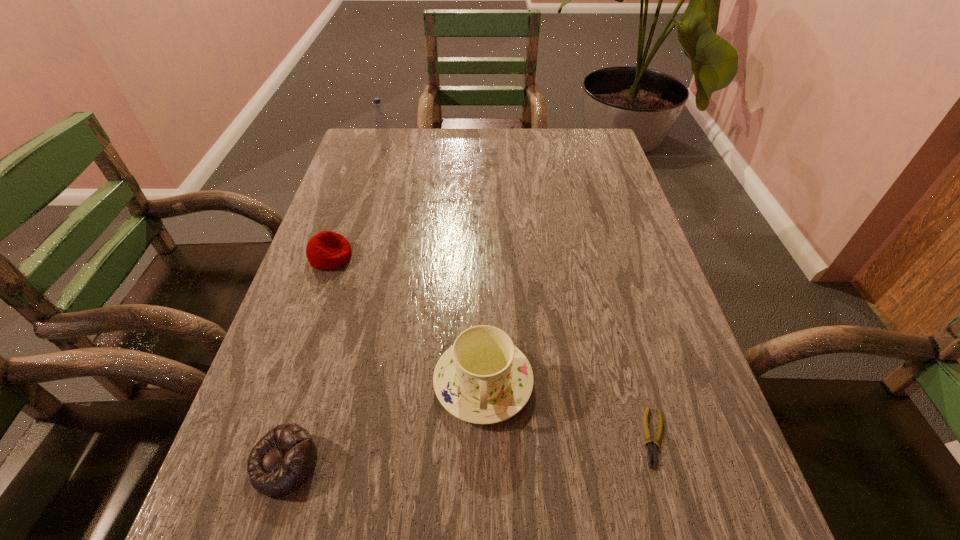
This screenshot has width=960, height=540. In order to click on vacant space located on the front of the farthest object in this screenshot , I will do `click(372, 192)`.

Locate an element on the screen. The width and height of the screenshot is (960, 540). free space located 0.150m on the handle side of the second tallest object is located at coordinates (484, 521).

Where is `vacant area situated 0.170m on the seat area of the third shortest object`? The image size is (960, 540). vacant area situated 0.170m on the seat area of the third shortest object is located at coordinates (420, 256).

Locate an element on the screen. vacant space situated on the back of the nearer beanbag is located at coordinates (338, 288).

You are a GUI agent. You are given a task and a screenshot of the screen. Output one action in this format:
    pyautogui.click(x=<x>, y=<y>)
    Task: Click on the vacant region located 0.050m on the back of the pliers
    This screenshot has height=540, width=960.
    Given the screenshot: What is the action you would take?
    pyautogui.click(x=639, y=385)

Image resolution: width=960 pixels, height=540 pixels. I want to click on object at the far edge, so click(x=379, y=117).

Locate an element on the screen. This screenshot has width=960, height=540. water bottle at the left edge is located at coordinates [x=379, y=117].

Find the location of a particular element. The image size is (960, 540). object at the right edge is located at coordinates (652, 450).

Image resolution: width=960 pixels, height=540 pixels. What are the coordinates of `object that is at the far left corner` in the screenshot? It's located at (379, 117).

Identify the location of free space at the left edge of the desktop. (385, 213).